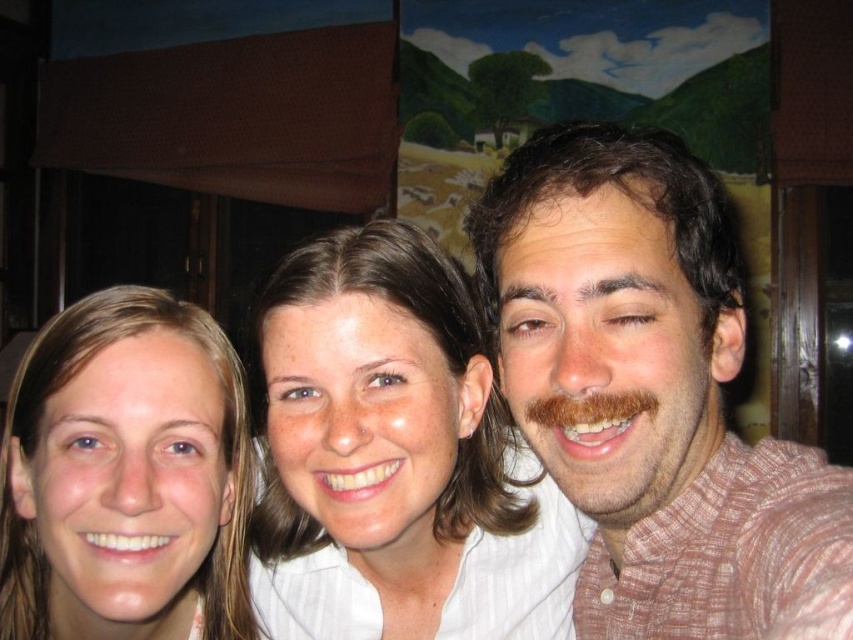
Consider the image. Who is more distant from viewer, (770, 545) or (413, 256)?

The point (413, 256) is behind.

Is the position of brown hair at right more distant than that of smooth white shirt at center?

No.

Identify the location of brown hair at right. This screenshot has height=640, width=853. (653, 394).

Is smooth white shirt at center taller than smooth skin face at center?

Indeed, smooth white shirt at center has a greater height compared to smooth skin face at center.

Does point (271, 502) lie in front of point (94, 406)?

No, it is behind (94, 406).

Locate an element on the screen. The height and width of the screenshot is (640, 853). smooth white shirt at center is located at coordinates (396, 460).

Between point (488, 216) and point (163, 563), which one is positioned behind?

Positioned behind is point (163, 563).

Based on the photo, who is positioned more to the left, brown hair at right or smooth skin face at center?

smooth skin face at center is more to the left.

The width and height of the screenshot is (853, 640). Find the location of `brown hair at right`. brown hair at right is located at coordinates (653, 394).